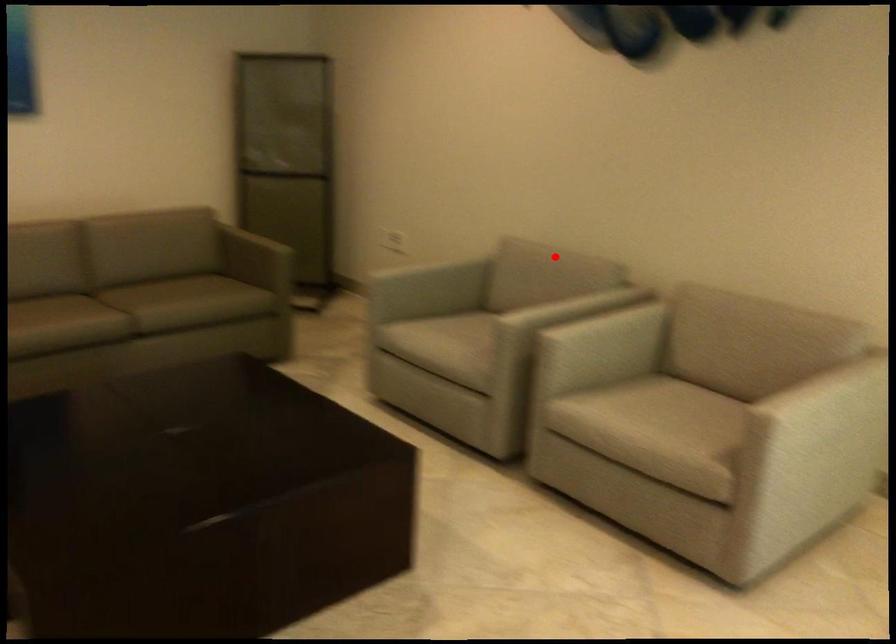
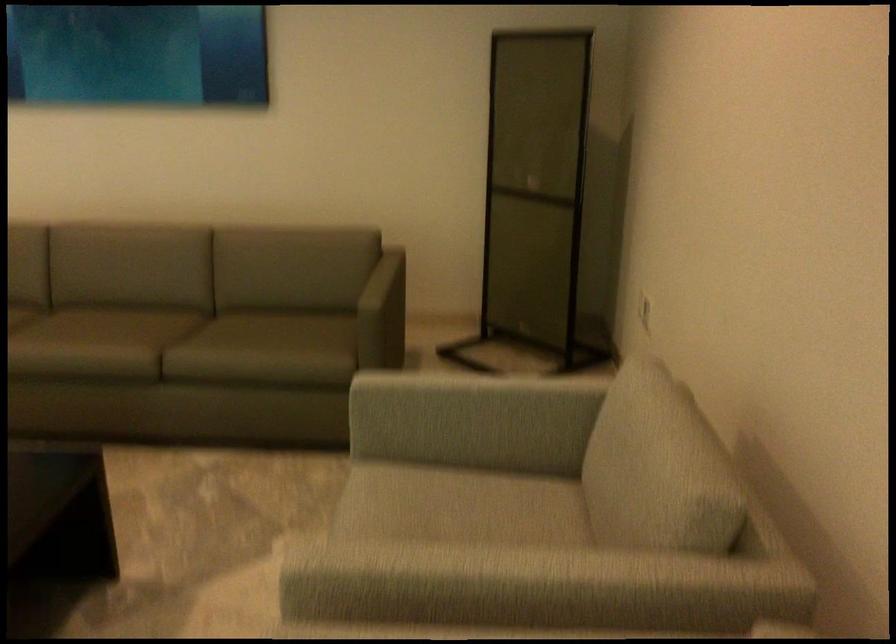
The point at the highlighted location is marked in the first image. Where is the corresponding point in the second image?

(653, 451)